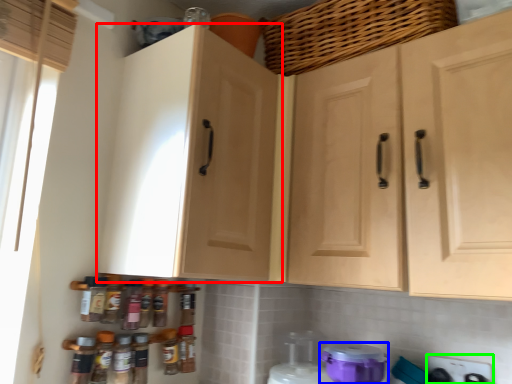
Question: Which object is the closest to the cabinetry (highlighted by a red box)? Choose among these: appliance (highlighted by a blue box) or appliance (highlighted by a green box).

Choices:
 (A) appliance
 (B) appliance

Answer: (A)